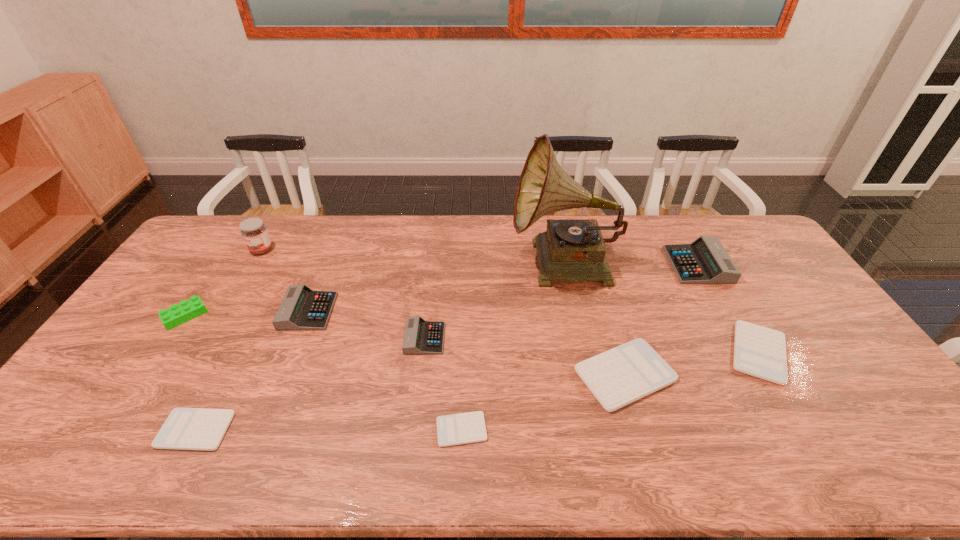
Where is `the closest object to the second smallest gray calculator`? This screenshot has width=960, height=540. the closest object to the second smallest gray calculator is located at coordinates (254, 232).

I want to click on object that ranks as the closest to the shortest calculator, so click(x=421, y=337).

Point out which calculator is positioned as the fourth nearest to the leftmost gray calculator. Please provide its 2D coordinates. Your answer should be formatted as a tuple, i.e. [(x, y)], where the tuple contains the x and y coordinates of a point satisfying the conditions above.

[(631, 371)]

Choose which calculator is the second nearest neighbor to the second tallest calculator. Please provide its 2D coordinates. Your answer should be formatted as a tuple, i.e. [(x, y)], where the tuple contains the x and y coordinates of a point satisfying the conditions above.

[(185, 428)]

Find the location of `the second closest gray calculator to the leftmost object`. the second closest gray calculator to the leftmost object is located at coordinates (421, 337).

Point out which gray calculator is positioned as the third nearest to the shortest object. Please provide its 2D coordinates. Your answer should be formatted as a tuple, i.e. [(x, y)], where the tuple contains the x and y coordinates of a point satisfying the conditions above.

[(705, 261)]

Identify the location of white calculator object that ranks as the third closest to the ninth tallest object. The image size is (960, 540). (758, 351).

Where is `white calculator that is the third closest to the shortest object`? The height and width of the screenshot is (540, 960). white calculator that is the third closest to the shortest object is located at coordinates pos(758,351).

Image resolution: width=960 pixels, height=540 pixels. Find the location of `vacant space that satisfies the following two spatial constraints: 1. on the front side of the green Lego; 2. on the right side of the biggest white calculator`. vacant space that satisfies the following two spatial constraints: 1. on the front side of the green Lego; 2. on the right side of the biggest white calculator is located at coordinates (146, 375).

You are a GUI agent. You are given a task and a screenshot of the screen. Output one action in this format:
    pyautogui.click(x=<x>, y=<y>)
    Task: Click on the free spot that satisfies the following two spatial constraints: 1. from the horn of the record player; 2. on the front side of the Lego
    
    Given the screenshot: What is the action you would take?
    pyautogui.click(x=575, y=316)